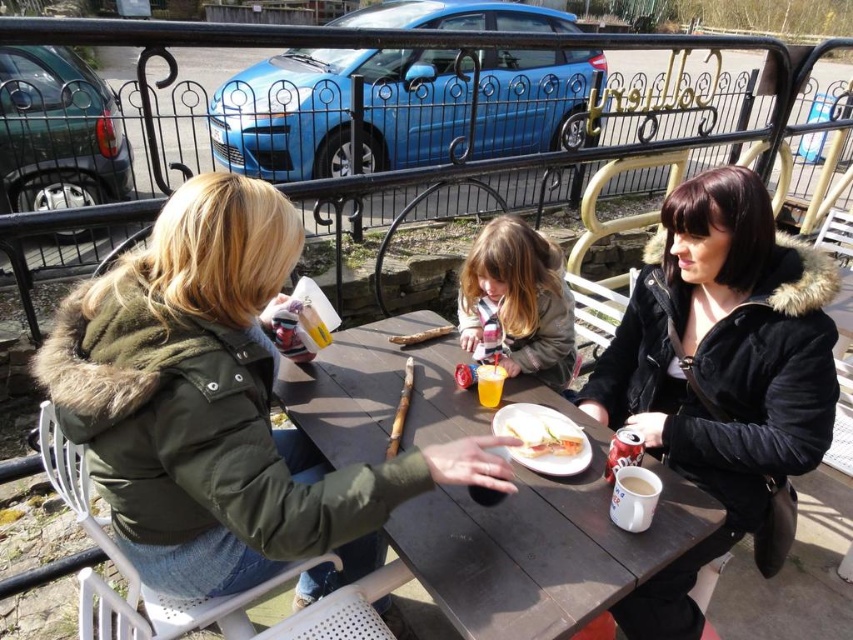
Question: Is black fur-trimmed jacket at upper right to the left of light brown hair at center from the viewer's perspective?

Choices:
 (A) no
 (B) yes

Answer: (A)

Question: Which point is closer to the camera?

Choices:
 (A) (456, 556)
 (B) (813, 275)
 (C) (468, 337)
 (D) (466, 445)

Answer: (A)

Question: Does black fur-trimmed jacket at upper right have a smaller size compared to wooden table at center?

Choices:
 (A) no
 (B) yes

Answer: (B)

Question: Which point is closer to the camera?

Choices:
 (A) (534, 248)
 (B) (192, 333)
 (C) (398, 323)
 (D) (505, 429)

Answer: (B)

Question: Does green fuzzy jacket at center appear on the left side of white bread at center?

Choices:
 (A) no
 (B) yes

Answer: (B)

Question: Among these points, which one is nearest to the camera?

Choices:
 (A) (469, 294)
 (B) (682, 320)
 (C) (531, 445)
 (D) (560, 520)

Answer: (D)